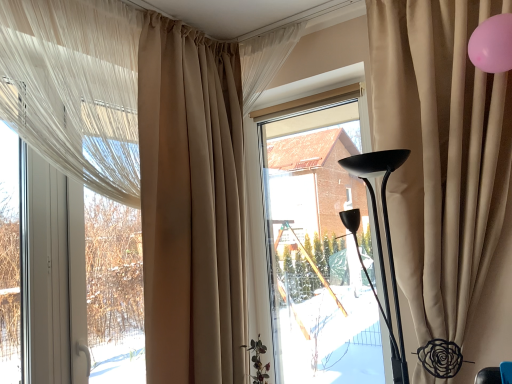
Question: Is beige velvet curtain at right, acting as the 4th curtain starting from the left, located outside transparent glass window at center?

Choices:
 (A) yes
 (B) no

Answer: (A)

Question: Are beige velvet curtain at right, the 1th curtain positioned from the right, and transparent glass window at center making contact?

Choices:
 (A) yes
 (B) no

Answer: (B)

Question: Considering the relative sizes of beige velvet curtain at right, acting as the 4th curtain starting from the left, and transparent glass window at center in the image provided, is beige velvet curtain at right, acting as the 4th curtain starting from the left, bigger than transparent glass window at center?

Choices:
 (A) no
 (B) yes

Answer: (B)

Question: Does beige velvet curtain at right, the 1th curtain positioned from the right, have a smaller size compared to transparent glass window at center?

Choices:
 (A) yes
 (B) no

Answer: (B)

Question: From the image's perspective, is beige velvet curtain at right, the 1th curtain positioned from the right, located beneath transparent glass window at center?

Choices:
 (A) yes
 (B) no

Answer: (B)

Question: Considering the relative sizes of beige velvet curtain at right, the 1th curtain positioned from the right, and transparent glass window at center in the image provided, is beige velvet curtain at right, the 1th curtain positioned from the right, shorter than transparent glass window at center?

Choices:
 (A) no
 (B) yes

Answer: (A)

Question: Considering the relative sizes of transparent glass window at center and beige fabric curtain at left, the 2th curtain when ordered from left to right, in the image provided, is transparent glass window at center wider than beige fabric curtain at left, the 2th curtain when ordered from left to right,?

Choices:
 (A) no
 (B) yes

Answer: (A)

Question: Considering the relative positions of transparent glass window at center and beige fabric curtain at left, the 2th curtain when ordered from left to right, in the image provided, is transparent glass window at center behind beige fabric curtain at left, the 2th curtain when ordered from left to right,?

Choices:
 (A) yes
 (B) no

Answer: (A)

Question: Is transparent glass window at center to the left of beige fabric curtain at left, placed as the 3th curtain when sorted from right to left, from the viewer's perspective?

Choices:
 (A) yes
 (B) no

Answer: (B)

Question: Is transparent glass window at center positioned in front of beige fabric curtain at left, placed as the 3th curtain when sorted from right to left?

Choices:
 (A) no
 (B) yes

Answer: (A)

Question: From the image's perspective, would you say transparent glass window at center is positioned over beige fabric curtain at left, the 2th curtain when ordered from left to right?

Choices:
 (A) no
 (B) yes

Answer: (A)

Question: Is transparent glass window at center not inside beige fabric curtain at left, placed as the 3th curtain when sorted from right to left?

Choices:
 (A) no
 (B) yes

Answer: (B)

Question: Is beige fabric curtain at left, the 2th curtain when ordered from left to right, shorter than beige velvet curtain at right, acting as the 4th curtain starting from the left?

Choices:
 (A) yes
 (B) no

Answer: (B)